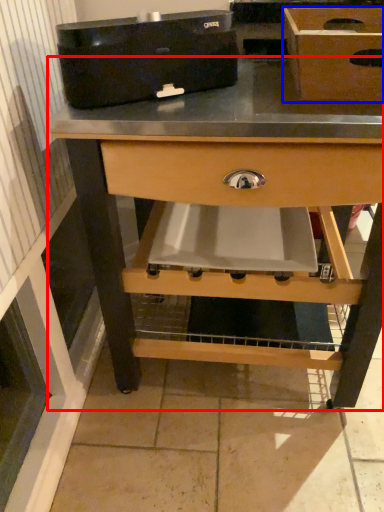
Question: Which of the following is the farthest to the observer, table (highlighted by a red box) or box (highlighted by a blue box)?

Choices:
 (A) table
 (B) box

Answer: (A)